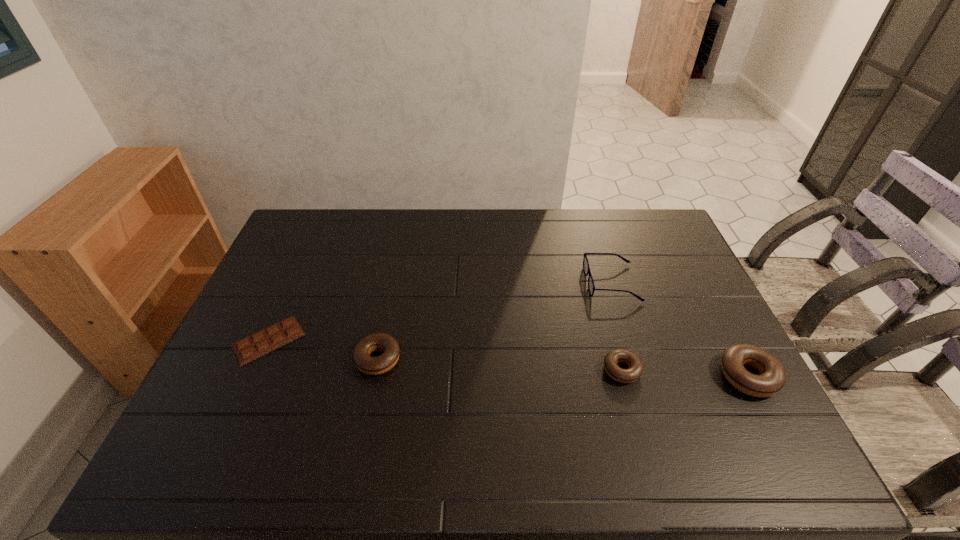
The width and height of the screenshot is (960, 540). What are the coordinates of `vacant position in the image that satisfies the following two spatial constraints: 1. on the front-facing side of the farthest object; 2. on the back side of the rightmost doughnut` in the screenshot? It's located at (640, 376).

Find the location of a particular element. The image size is (960, 540). vacant space that satisfies the following two spatial constraints: 1. on the front side of the second doughnut from right to left; 2. on the left side of the leftmost object is located at coordinates (255, 370).

Locate an element on the screen. blank space that satisfies the following two spatial constraints: 1. on the front side of the shortest doughnut; 2. on the right side of the leftmost doughnut is located at coordinates (375, 370).

The height and width of the screenshot is (540, 960). Identify the location of free spot that satisfies the following two spatial constraints: 1. on the front-facing side of the spectacles; 2. on the back side of the tallest doughnut. (640, 376).

Find the location of a particular element. This screenshot has width=960, height=540. free region that satisfies the following two spatial constraints: 1. on the front-facing side of the farthest object; 2. on the front side of the leftmost object is located at coordinates (630, 340).